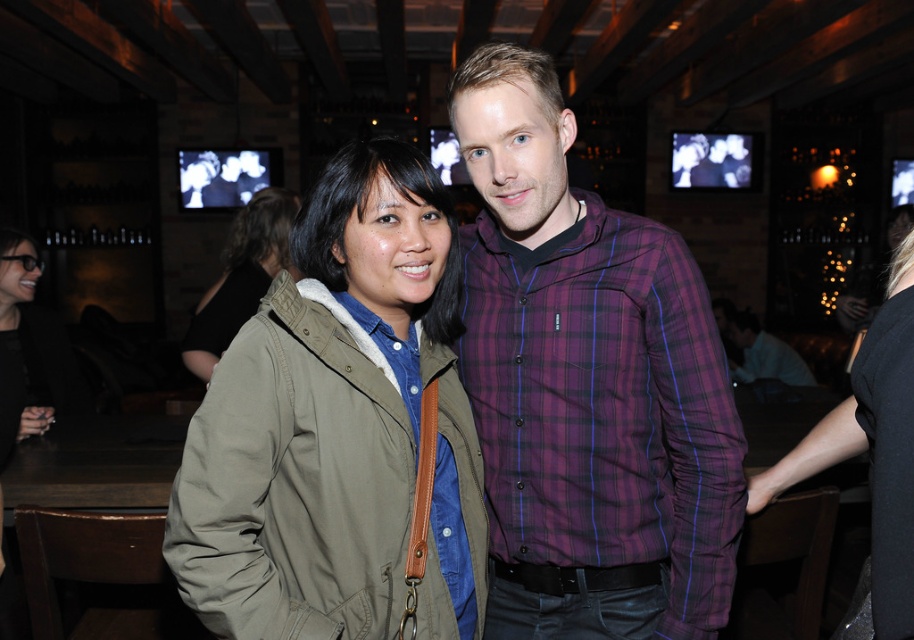
Question: Can you confirm if plaid fabric shirt at center is positioned to the right of khaki fabric jacket at center?

Choices:
 (A) no
 (B) yes

Answer: (B)

Question: Does plaid fabric shirt at center have a larger size compared to khaki fabric jacket at center?

Choices:
 (A) yes
 (B) no

Answer: (B)

Question: Which point is closer to the camera?

Choices:
 (A) olive green jacket at center
 (B) matte black jacket at lower left
 (C) plaid fabric shirt at center

Answer: (A)

Question: Which point is farther to the camera?

Choices:
 (A) (346, 198)
 (B) (555, 193)
 (C) (861, 420)
 (D) (214, 353)

Answer: (D)

Question: Is black fabric dress at lower right to the right of matte black jacket at lower left from the viewer's perspective?

Choices:
 (A) no
 (B) yes

Answer: (B)

Question: Which object is positioned closest to the olive green jacket at center?

Choices:
 (A) matte black jacket at lower left
 (B) plaid cotton shirt at center

Answer: (A)